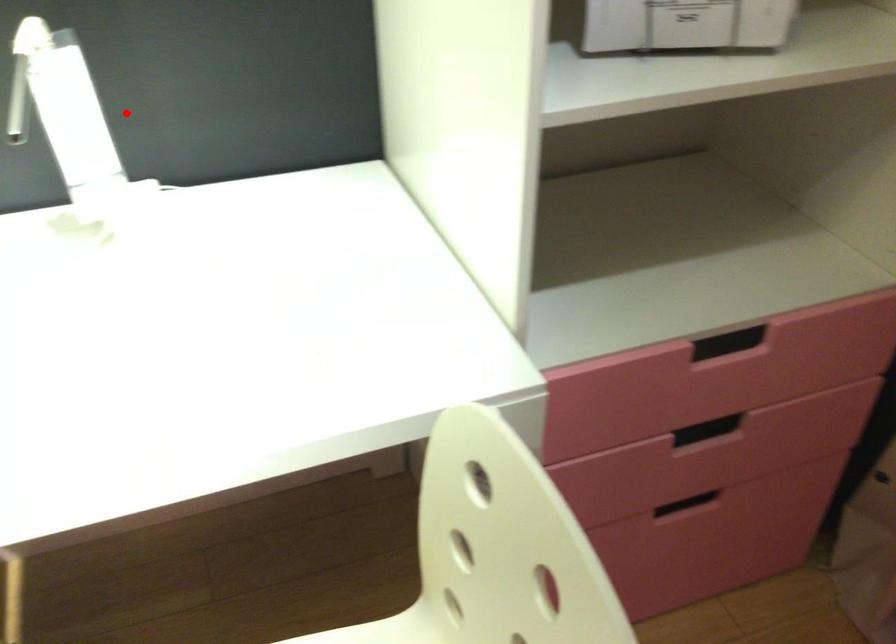
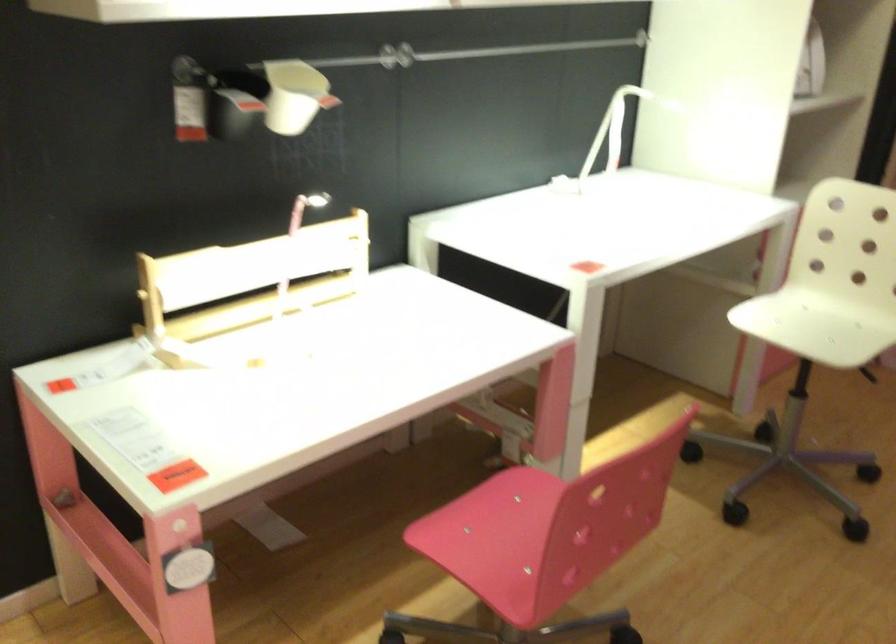
Question: A red point is marked in image1. In image2, is the corresponding 3D point closer to the camera or farther? Reply with the corresponding letter.

Choices:
 (A) The corresponding 3D point is closer.
 (B) The corresponding 3D point is farther.

Answer: (B)